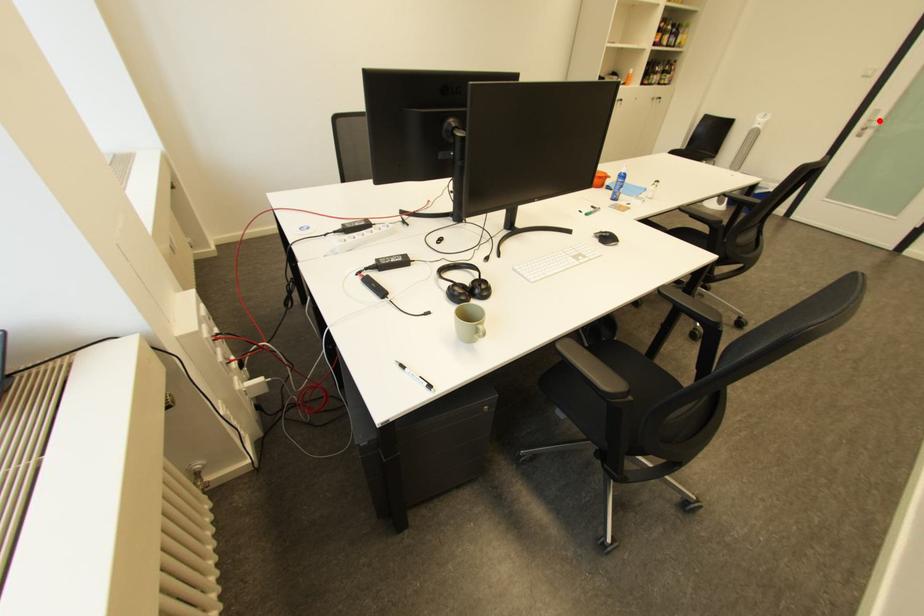
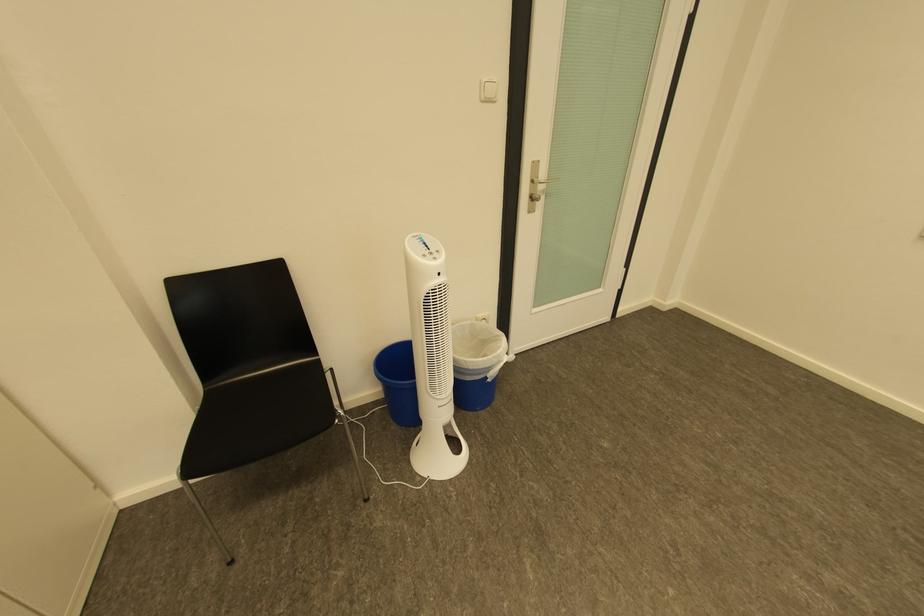
Question: I am providing you with two images of the same scene from different viewpoints. A red point is marked on the first image. Is the red point's position out of view in image 2?

Choices:
 (A) Yes
 (B) No

Answer: (B)